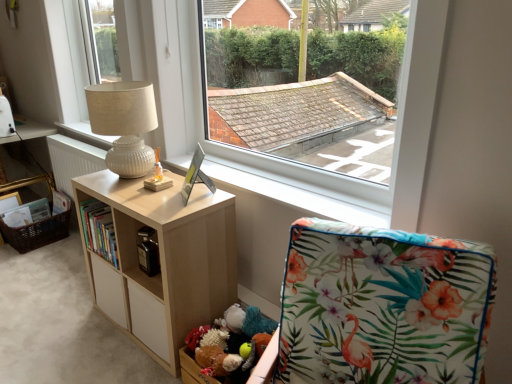
Find the location of a particular element. free space above light wood/texture bookshelf at center (from a real-world perspective) is located at coordinates (151, 193).